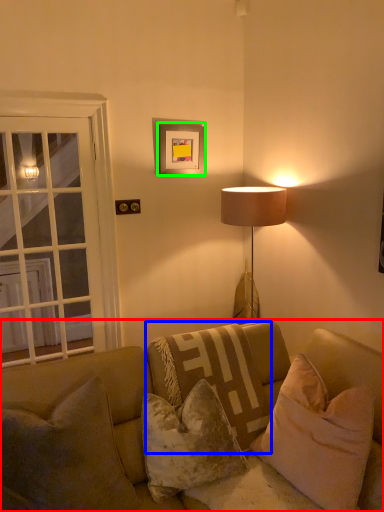
Question: Estimate the real-world distances between objects in this image. Which object is closer to studio couch (highlighted by a red box), pillow (highlighted by a blue box) or picture frame (highlighted by a green box)?

Choices:
 (A) pillow
 (B) picture frame

Answer: (A)